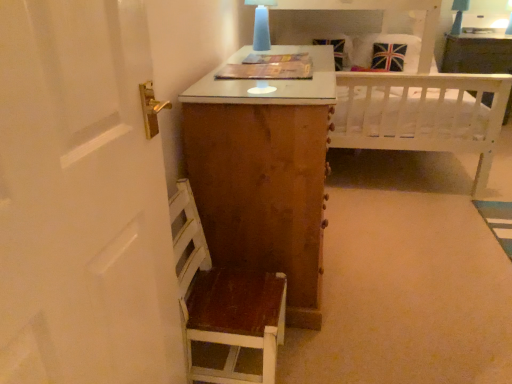
Question: Considering the positions of white wood vanity at upper right and union jack fabric pillow at upper right in the image, is white wood vanity at upper right wider or thinner than union jack fabric pillow at upper right?

Choices:
 (A) thin
 (B) wide

Answer: (B)

Question: From the image's perspective, is white wood vanity at upper right positioned above or below union jack fabric pillow at upper right?

Choices:
 (A) below
 (B) above

Answer: (A)

Question: Which object is positioned farthest from the union jack fabric pillow at upper right?

Choices:
 (A) matte blue glass at upper center
 (B) white wooden bed at upper center
 (C) wooden chair at lower left
 (D) white wood vanity at upper right

Answer: (C)

Question: Which object is the closest to the wooden chair at lower left?

Choices:
 (A) matte blue glass at upper center
 (B) white wood vanity at upper right
 (C) white wooden bed at upper center
 (D) union jack fabric pillow at upper right

Answer: (A)